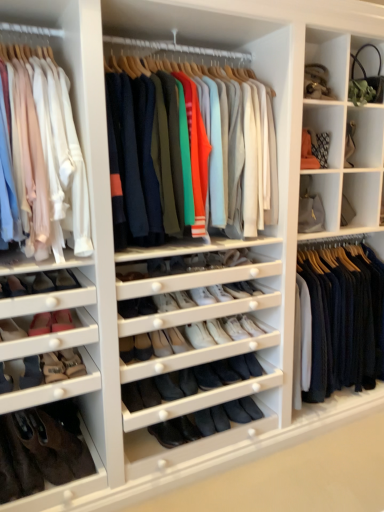
Question: Should I look upward or downward to see suede black shoe at lower left, positioned as the 10th shoe in right-to-left order?

Choices:
 (A) down
 (B) up

Answer: (A)

Question: Is the position of black suede shoe at center, arranged as the third shoe when viewed from the right, less distant than that of suede brown shoe at lower left, the 4th shoe positioned from the right?

Choices:
 (A) no
 (B) yes

Answer: (A)

Question: From a real-world perspective, is black suede shoe at center, arranged as the eighth shoe when viewed from the left, located beneath suede brown shoe at lower left, which is the 7th shoe in left-to-right order?

Choices:
 (A) no
 (B) yes

Answer: (B)

Question: Can you confirm if black suede shoe at center, arranged as the eighth shoe when viewed from the left, is positioned to the right of suede brown shoe at lower left, the 4th shoe positioned from the right?

Choices:
 (A) yes
 (B) no

Answer: (A)

Question: Is black suede shoe at center, arranged as the eighth shoe when viewed from the left, beside suede brown shoe at lower left, the 4th shoe positioned from the right?

Choices:
 (A) yes
 (B) no

Answer: (B)

Question: Can you confirm if black suede shoe at center, arranged as the eighth shoe when viewed from the left, is taller than suede brown shoe at lower left, which is the 7th shoe in left-to-right order?

Choices:
 (A) no
 (B) yes

Answer: (A)

Question: From the image's perspective, is black suede shoe at center, arranged as the eighth shoe when viewed from the left, below suede brown shoe at lower left, which is the 7th shoe in left-to-right order?

Choices:
 (A) no
 (B) yes

Answer: (B)

Question: Is matte white shirts at left, arranged as the first clothing when viewed from the left, oriented towards matte pink shoe at lower left, which is counted as the seventh shoe, starting from the right?

Choices:
 (A) no
 (B) yes

Answer: (A)

Question: Is matte white shirts at left, the third clothing viewed from the right, facing away from matte pink shoe at lower left, which is counted as the seventh shoe, starting from the right?

Choices:
 (A) yes
 (B) no

Answer: (B)

Question: Does matte white shirts at left, the third clothing viewed from the right, come behind matte pink shoe at lower left, which is counted as the seventh shoe, starting from the right?

Choices:
 (A) yes
 (B) no

Answer: (B)

Question: Could matte pink shoe at lower left, which is counted as the seventh shoe, starting from the right, be considered to be inside matte white shirts at left, arranged as the first clothing when viewed from the left?

Choices:
 (A) yes
 (B) no

Answer: (B)

Question: Does matte white shirts at left, arranged as the first clothing when viewed from the left, have a lesser height compared to matte pink shoe at lower left, placed as the fourth shoe when sorted from left to right?

Choices:
 (A) no
 (B) yes

Answer: (A)

Question: From a real-world perspective, is matte white shirts at left, arranged as the first clothing when viewed from the left, positioned under matte pink shoe at lower left, placed as the fourth shoe when sorted from left to right, based on gravity?

Choices:
 (A) yes
 (B) no

Answer: (B)

Question: Would you say suede brown shoe at lower left, the 4th shoe positioned from the right, is outside knit sweater at center, acting as the 2th clothing starting from the left?

Choices:
 (A) yes
 (B) no

Answer: (A)